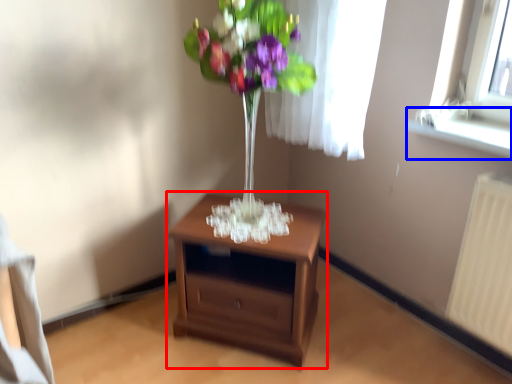
Question: Which of the following is the farthest to the observer, nightstand (highlighted by a red box) or window sill (highlighted by a blue box)?

Choices:
 (A) nightstand
 (B) window sill

Answer: (A)